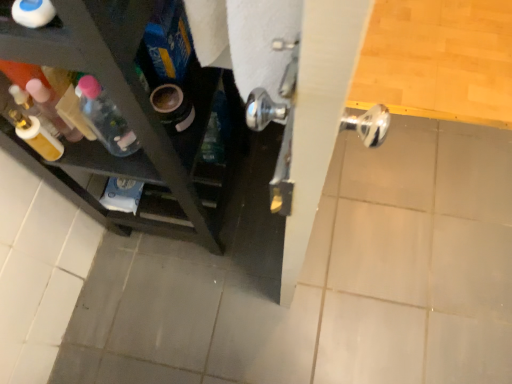
Question: From a real-world perspective, does translucent plastic bottle at left, the 2th bottle when ordered from right to left, stand above translucent plastic bottle at left, arranged as the 1th bottle when viewed from the left?

Choices:
 (A) no
 (B) yes

Answer: (A)

Question: Is translucent plastic bottle at left, the 2th bottle when ordered from right to left, bigger than translucent plastic bottle at left, the 3th bottle viewed from the right?

Choices:
 (A) yes
 (B) no

Answer: (B)

Question: Considering the relative sizes of translucent plastic bottle at left, which is the 3th bottle in front-to-back order, and translucent plastic bottle at left, arranged as the 1th bottle when viewed from the left, in the image provided, is translucent plastic bottle at left, which is the 3th bottle in front-to-back order, shorter than translucent plastic bottle at left, arranged as the 1th bottle when viewed from the left,?

Choices:
 (A) no
 (B) yes

Answer: (B)

Question: From the image's perspective, is translucent plastic bottle at left, which is the first bottle from back to front, located beneath translucent plastic bottle at left, arranged as the 1th bottle when viewed from the left?

Choices:
 (A) no
 (B) yes

Answer: (B)

Question: Can you confirm if translucent plastic bottle at left, the 2th bottle when ordered from right to left, is wider than translucent plastic bottle at left, the 2th bottle when ordered from back to front?

Choices:
 (A) yes
 (B) no

Answer: (B)

Question: Is translucent plastic bottle at left, the 2th bottle when ordered from right to left, taller than translucent plastic bottle at left, the 3th bottle viewed from the right?

Choices:
 (A) no
 (B) yes

Answer: (A)

Question: From the image's perspective, is translucent plastic bottle at left, the 2th bottle in the front-to-back sequence, under white glossy bottle at upper left, the 1th bottle viewed from the right?

Choices:
 (A) no
 (B) yes

Answer: (B)

Question: From the image's perspective, is translucent plastic bottle at left, the 3th bottle viewed from the right, located above white glossy bottle at upper left, acting as the first bottle starting from the front?

Choices:
 (A) yes
 (B) no

Answer: (B)

Question: Can you confirm if translucent plastic bottle at left, the 2th bottle in the front-to-back sequence, is wider than white glossy bottle at upper left, acting as the first bottle starting from the front?

Choices:
 (A) yes
 (B) no

Answer: (A)

Question: Does translucent plastic bottle at left, the 2th bottle in the front-to-back sequence, appear on the right side of white glossy bottle at upper left, which ranks as the third bottle in back-to-front order?

Choices:
 (A) yes
 (B) no

Answer: (B)

Question: Is translucent plastic bottle at left, arranged as the 1th bottle when viewed from the left, facing towards white glossy bottle at upper left, which ranks as the third bottle in back-to-front order?

Choices:
 (A) no
 (B) yes

Answer: (A)

Question: From a real-world perspective, is translucent plastic bottle at left, arranged as the 1th bottle when viewed from the left, on top of white glossy bottle at upper left, acting as the first bottle starting from the front?

Choices:
 (A) yes
 (B) no

Answer: (B)

Question: Would you say white glossy bottle at upper left, acting as the first bottle starting from the front, contains translucent plastic bottle at left, the 3th bottle viewed from the right?

Choices:
 (A) yes
 (B) no

Answer: (B)